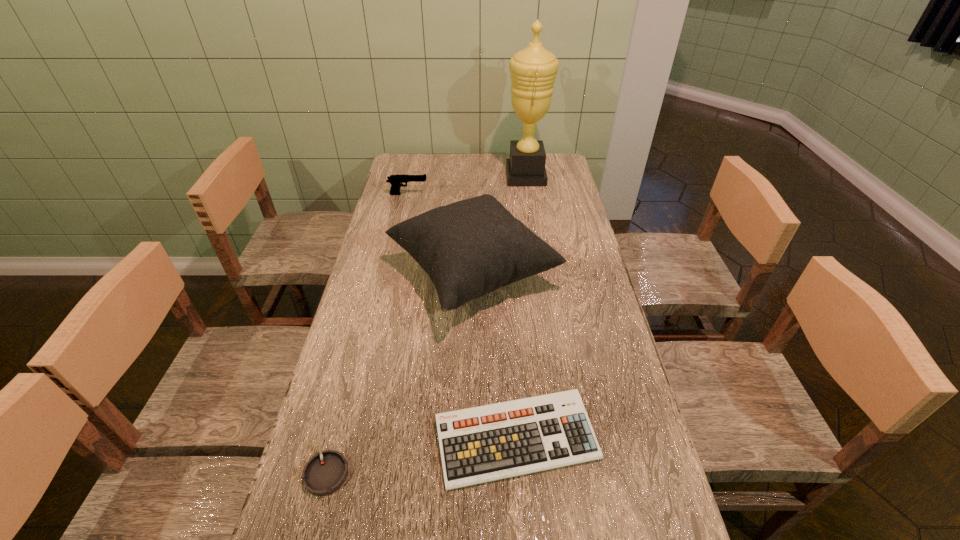
Image resolution: width=960 pixels, height=540 pixels. I want to click on object that stands as the second closest to the cushion, so click(x=396, y=181).

Identify the location of vacant space that satisfies the following two spatial constraints: 1. on the back side of the shortest object; 2. on the left side of the computer keyboard. The width and height of the screenshot is (960, 540). coord(335,439).

The width and height of the screenshot is (960, 540). Find the location of `free space that satisfies the following two spatial constraints: 1. on the back side of the ashtray; 2. on the left side of the third nearest object`. free space that satisfies the following two spatial constraints: 1. on the back side of the ashtray; 2. on the left side of the third nearest object is located at coordinates (378, 274).

This screenshot has height=540, width=960. I want to click on vacant region that satisfies the following two spatial constraints: 1. on the front-facing side of the fourth shortest object; 2. on the right side of the pistol, so pyautogui.click(x=390, y=274).